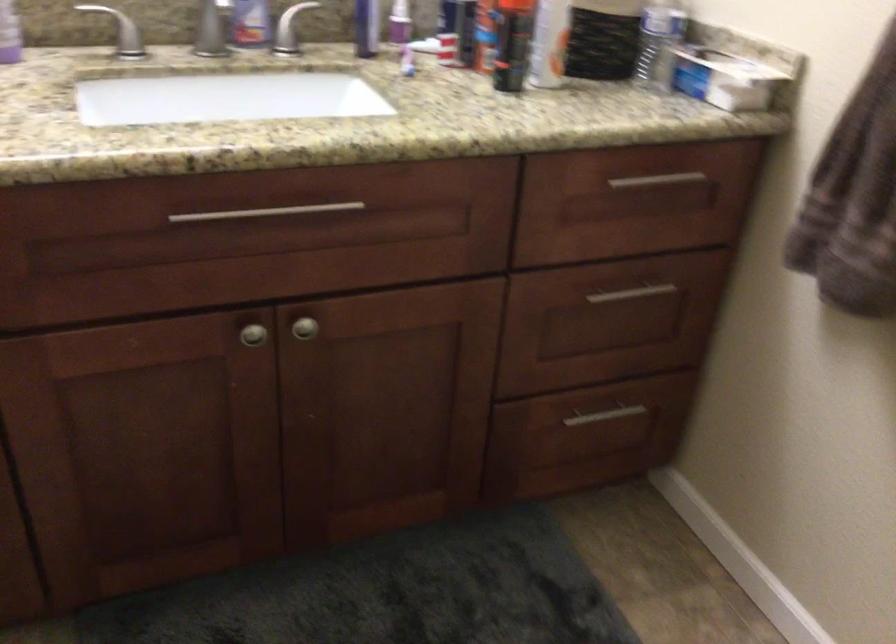
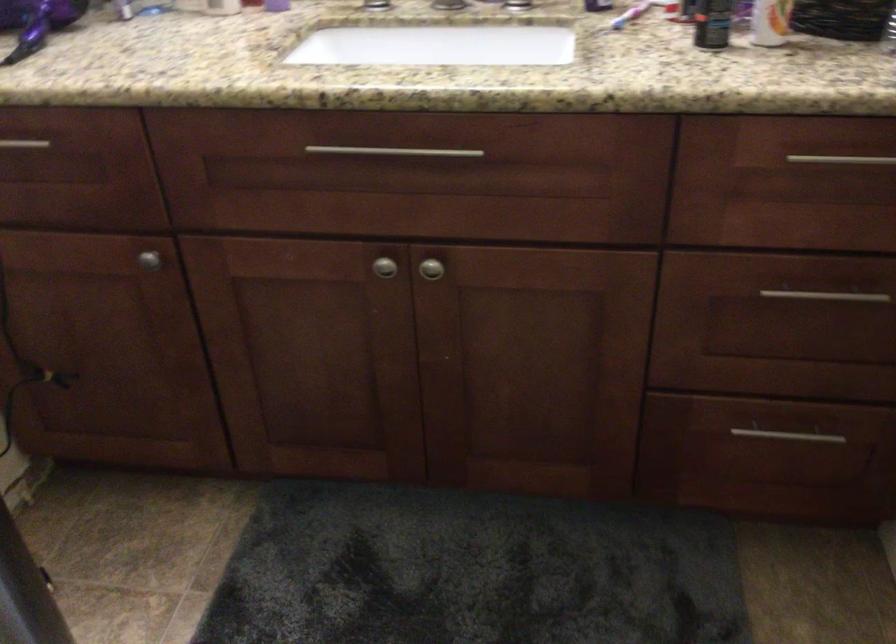
In the second image, find the point that corresponds to point (619, 308) in the first image.

(815, 310)